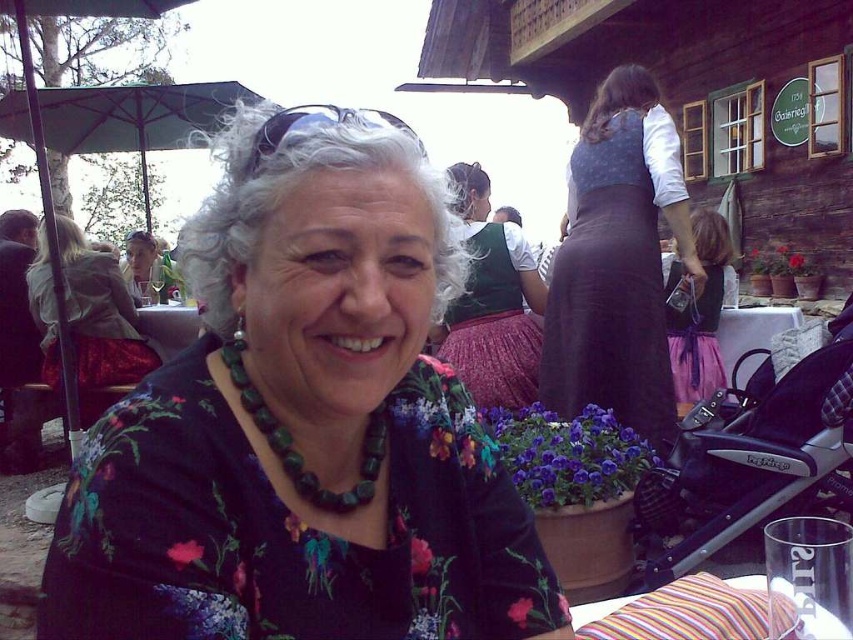
Question: Can you confirm if green velvet blouse at center is bigger than green fabric umbrella at upper left?

Choices:
 (A) yes
 (B) no

Answer: (B)

Question: Which point appears farthest from the camera in this image?

Choices:
 (A) pyautogui.click(x=370, y=444)
 (B) pyautogui.click(x=67, y=296)
 (C) pyautogui.click(x=541, y=301)
 (D) pyautogui.click(x=676, y=275)

Answer: (B)

Question: Can you confirm if floral fabric dress at center is bigger than green velvet blouse at center?

Choices:
 (A) no
 (B) yes

Answer: (A)

Question: Estimate the real-world distances between objects in this image. Which object is farther from the green velvet blouse at center?

Choices:
 (A) matte black hair at upper left
 (B) green fabric umbrella at upper left

Answer: (B)

Question: Is dark purple skirt at upper right to the left of green beaded necklace at center from the viewer's perspective?

Choices:
 (A) no
 (B) yes

Answer: (A)

Question: Estimate the real-world distances between objects in this image. Which object is closer to the green fabric umbrella at upper left?

Choices:
 (A) pink satin dress at center
 (B) wooden table at center
 (C) green velvet blouse at center

Answer: (B)